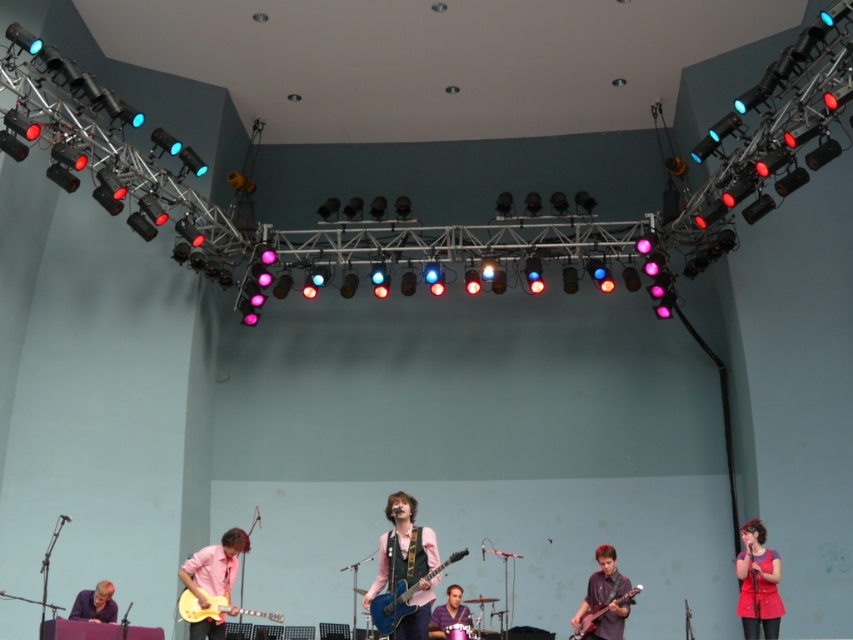
Question: Which object is the closest to the pink matte shirt at center?

Choices:
 (A) pink matte guitar at lower left
 (B) matte purple shirt at lower left

Answer: (A)

Question: Which is nearer to the pink glossy guitar at lower center?

Choices:
 (A) matte red vest at lower right
 (B) pink matte guitar at lower left
 (C) shiny blue electric guitar at center

Answer: (B)

Question: Among these objects, which one is nearest to the camera?

Choices:
 (A) pink matte shirt at center
 (B) matte purple shirt at lower left
 (C) blue glossy guitar at center

Answer: (C)

Question: Can you confirm if pink matte shirt at center is positioned to the right of purple fabric at center?

Choices:
 (A) no
 (B) yes

Answer: (A)

Question: Does pink matte shirt at center have a larger size compared to pink glossy guitar at lower center?

Choices:
 (A) no
 (B) yes

Answer: (B)

Question: Is matte red vest at lower right to the left of matte purple shirt at lower left from the viewer's perspective?

Choices:
 (A) no
 (B) yes

Answer: (A)